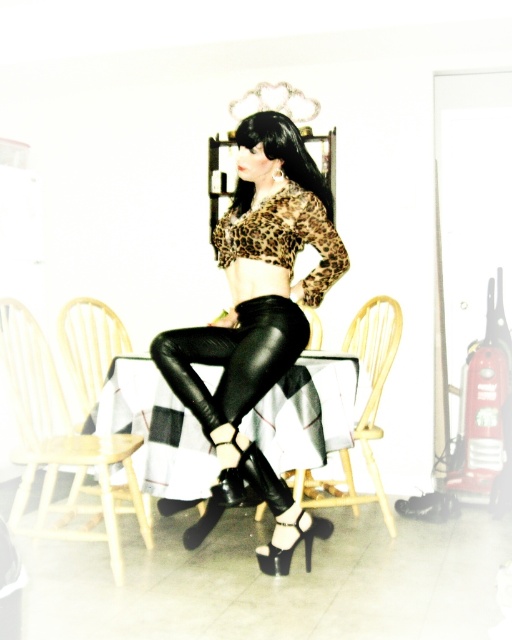
You are a guest at this dining table and want to place your bag on the leopard print fabric at center. However, you need to ensure it doesn not block the wooden chair at center. Based on their positions, can you place your bag there without blocking the chair?

The leopard print fabric at center is to the right of the wooden chair at center, so placing your bag on the leopard print fabric at center would not block the wooden chair at center since it is positioned to its right side.

You are a delivery person who needs to place a package on the dining table. The package is 3 meters long. Will it fit on the table between the black leather chair at center and the edge of the table?

The distance between the black leather chair at center and the edge of the table is 2.95 meters. Since the package is 3 meters long, it will not fit between them as it exceeds the available space by 0.05 meters.